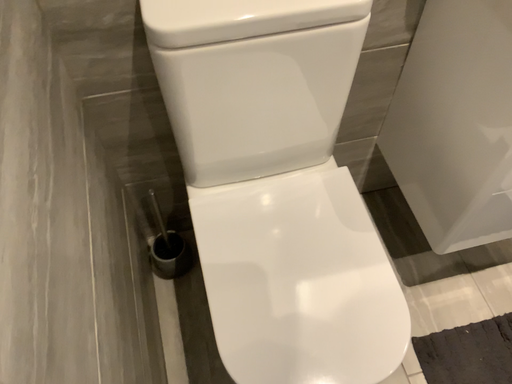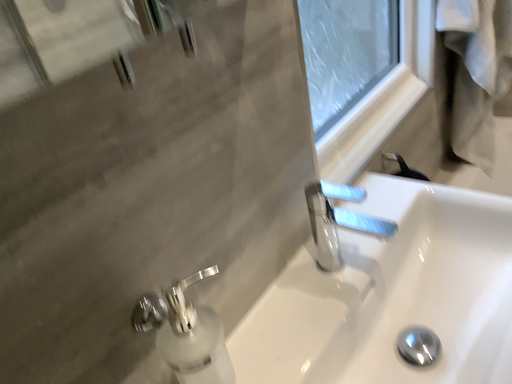
Question: Which way did the camera rotate in the video?

Choices:
 (A) rotated left
 (B) rotated right

Answer: (B)